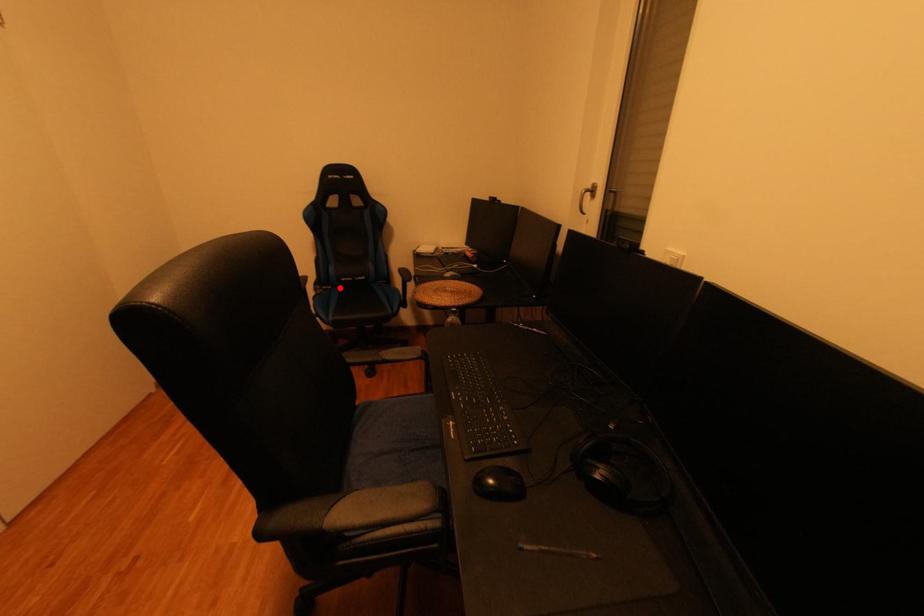
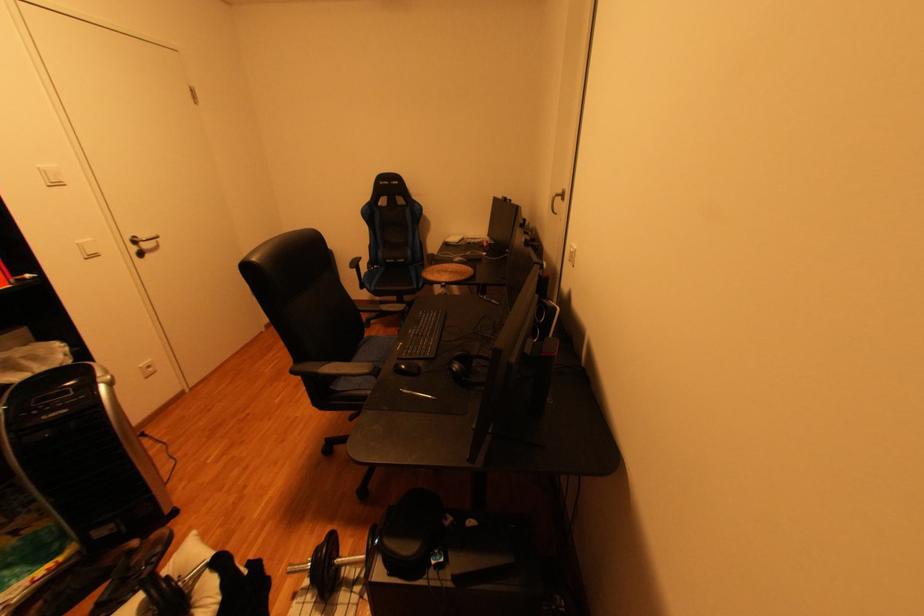
Question: I am providing you with two images of the same scene from different viewpoints. A red point is shown in image1. For the corresponding object point in image2, is it positioned nearer or farther from the camera?

Choices:
 (A) Nearer
 (B) Farther

Answer: (A)